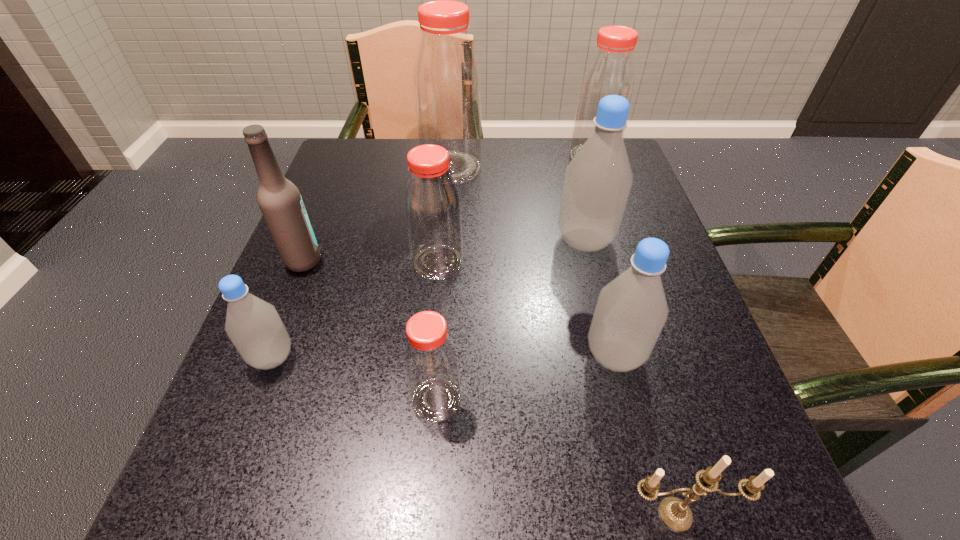
Where is `the second closest gray bottle relative to the smallest gray bottle`? Image resolution: width=960 pixels, height=540 pixels. the second closest gray bottle relative to the smallest gray bottle is located at coordinates [x=597, y=182].

This screenshot has width=960, height=540. I want to click on vacant area that satisfies the following two spatial constraints: 1. on the side of the beer bottle with the label; 2. on the right side of the second smallest gray bottle, so click(266, 355).

You are a GUI agent. You are given a task and a screenshot of the screen. Output one action in this format:
    pyautogui.click(x=<x>, y=<y>)
    Task: Click on the free space that satisfies the following two spatial constraints: 1. on the side of the second smallest red bottle with the label; 2. on the left side of the beer bottle
    
    Given the screenshot: What is the action you would take?
    pyautogui.click(x=302, y=262)

The height and width of the screenshot is (540, 960). What are the coordinates of `free spot that satisfies the following two spatial constraints: 1. on the back side of the leftmost bottle; 2. on the right side of the tallest bottle` in the screenshot? It's located at click(x=346, y=168).